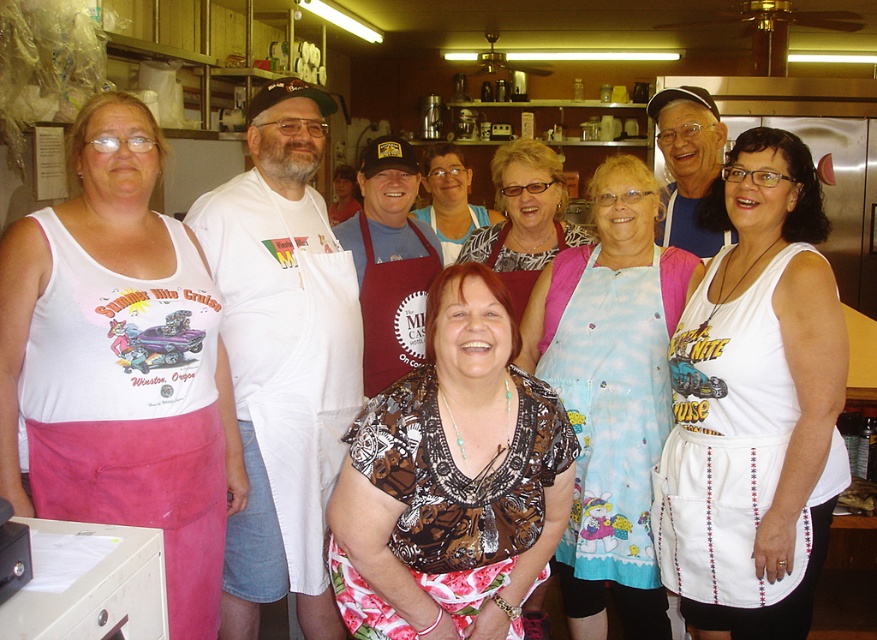
Is point (96, 304) farther from camera compared to point (464, 234)?

That is False.

This screenshot has width=877, height=640. I want to click on white fabric tank top at left, so click(119, 364).

In the scene shown: Is maroon fabric apron at center in front of matte brown apron at center?

Yes, it is.

Between point (407, 308) and point (435, 209), which one is positioned in front?

Positioned in front is point (407, 308).

Where is `maroon fabric apron at center`? The height and width of the screenshot is (640, 877). maroon fabric apron at center is located at coordinates (393, 308).

Can you confirm if white apron at center is shorter than matte brown apron at center?

Incorrect, white apron at center's height does not fall short of matte brown apron at center's.

Is white apron at center behind matte brown apron at center?

No, it is not.

Between point (297, 340) and point (428, 212), which one is positioned in front?

Point (297, 340)

The width and height of the screenshot is (877, 640). What are the coordinates of `white apron at center` in the screenshot? It's located at (282, 356).